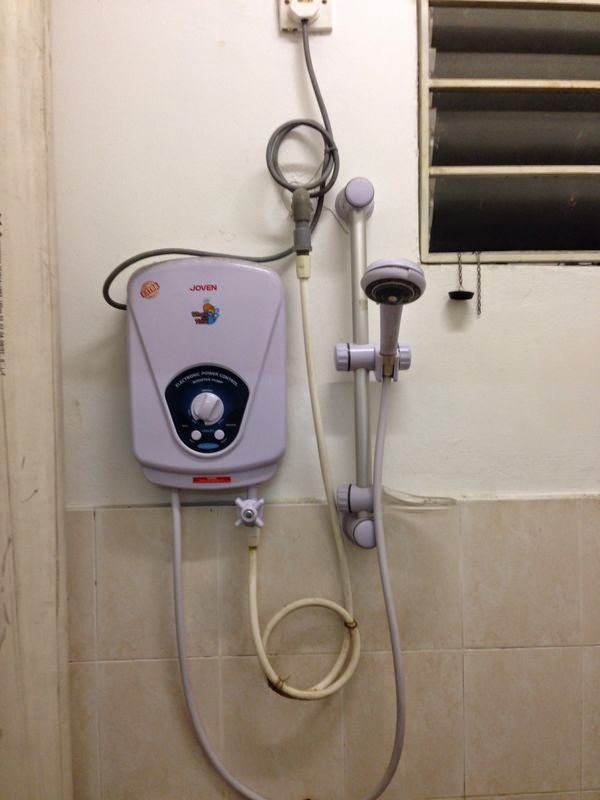
Where is `light gray knobs`? light gray knobs is located at coordinates (342, 502), (342, 362), (401, 360), (365, 190).